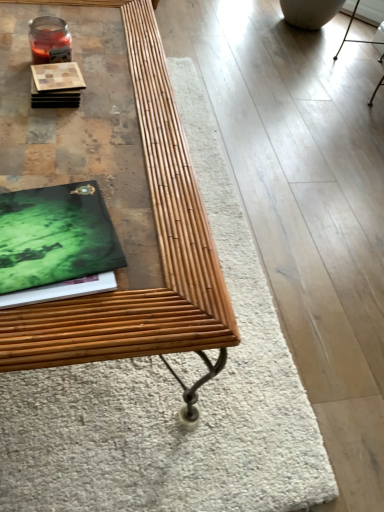
Locate an element on the screen. vacant area to the left of wooden coaster at upper left is located at coordinates (16, 76).